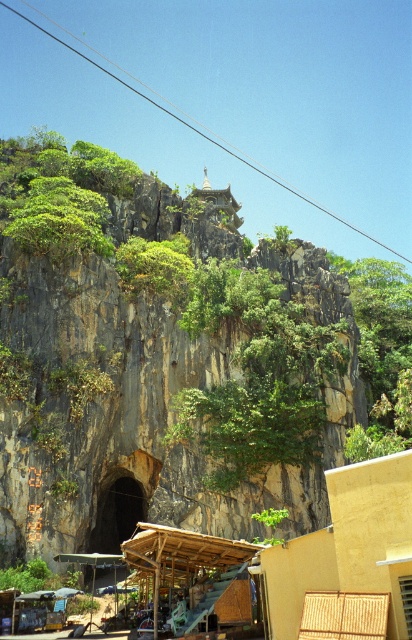
You are standing at the center of the scene and want to move towards the wooden canopy at lower center. Which direction should you go to avoid the beige wicker hut at lower right?

Since the beige wicker hut at lower right is to the right of the wooden canopy at lower center, you should move towards the left to reach the wooden canopy at lower center while avoiding the beige wicker hut at lower right.

You are a visitor at the market and want to find shelter from the rain. Which structure between the beige wicker hut at lower right and the wooden canopy at lower center would provide better protection from the rain?

The beige wicker hut at lower right is much taller than the wooden canopy at lower center, so it would provide better protection from the rain.

You are standing at the base of the cliff and want to reach the wooden canopy at lower center. There is a beige wicker hut at lower right in your path. Which structure should you move around to reach your destination?

You should move around the beige wicker hut at lower right since it is in front of the wooden canopy at lower center, blocking the direct path.